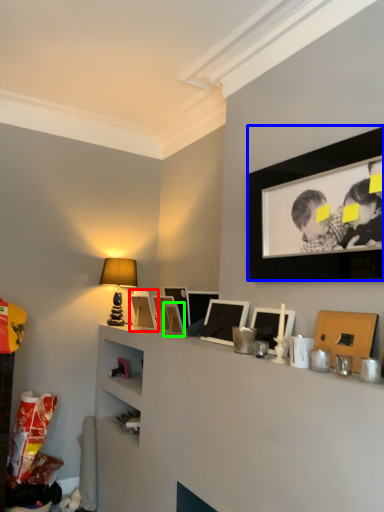
Question: Based on their relative distances, which object is nearer to picture frame (highlighted by a red box)? Choose from picture frame (highlighted by a blue box) and picture frame (highlighted by a green box).

Choices:
 (A) picture frame
 (B) picture frame

Answer: (B)